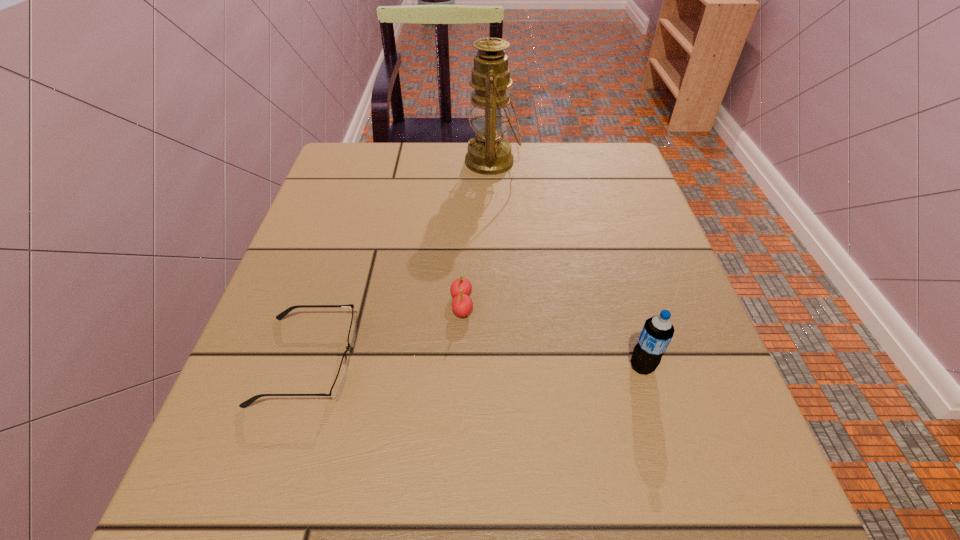
Identify the location of blank space located on the front-facing side of the spectacles. The image size is (960, 540). (462, 361).

Locate an element on the screen. object located at the far edge is located at coordinates (489, 153).

Where is `object that is at the left edge`? object that is at the left edge is located at coordinates (338, 385).

The height and width of the screenshot is (540, 960). I want to click on object situated at the right edge, so click(x=657, y=332).

The image size is (960, 540). I want to click on vacant space at the far edge of the desktop, so click(x=434, y=175).

Find the location of a particular element. vacant space at the near edge of the desktop is located at coordinates (509, 507).

This screenshot has width=960, height=540. Find the location of `vacant space at the right edge of the desktop`. vacant space at the right edge of the desktop is located at coordinates (655, 308).

Image resolution: width=960 pixels, height=540 pixels. I want to click on vacant area at the far left corner of the desktop, so click(x=338, y=192).

Identify the location of free space at the far right corner of the desktop. The width and height of the screenshot is (960, 540). (565, 150).

The width and height of the screenshot is (960, 540). Identify the location of free space between the cherry and the rightmost object. (552, 335).